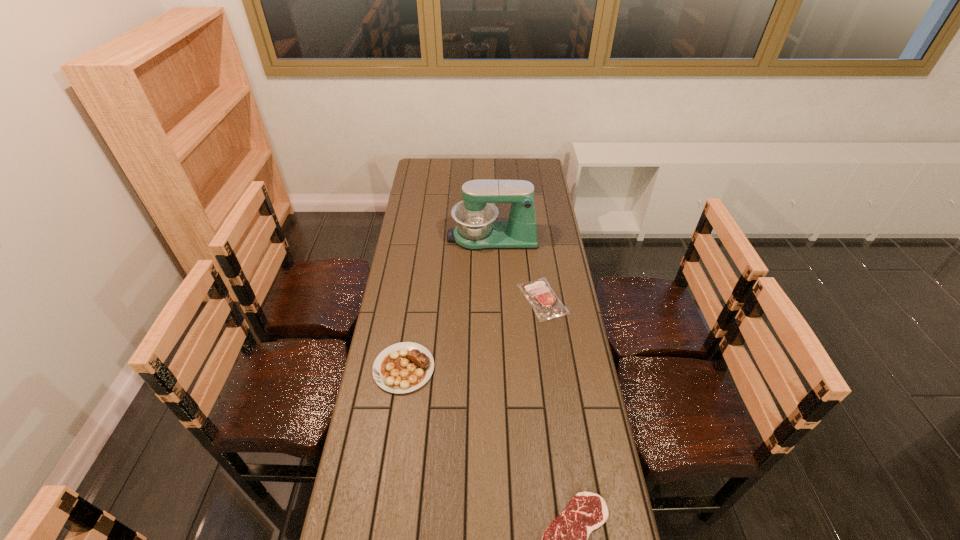
I want to click on vacant space situated 0.380m on the front of the second farthest object, so click(559, 415).

You are a GUI agent. You are given a task and a screenshot of the screen. Output one action in this format:
    pyautogui.click(x=<x>, y=<y>)
    Task: Click on the object that is at the left edge
    
    Given the screenshot: What is the action you would take?
    pyautogui.click(x=404, y=367)

Find the location of a particular element. The image size is (960, 540). mixer that is positioned at the right edge is located at coordinates (476, 229).

Identify the location of steak located at the right edge. This screenshot has width=960, height=540. (546, 305).

At what (x,y) coordinates should I click in order to perform the action: click on vacant space at the far edge. Please return your answer as a coordinate pair (x, y). The width and height of the screenshot is (960, 540). Looking at the image, I should click on (450, 174).

The image size is (960, 540). In the image, there is a desktop. Find the location of `vacant space at the left edge`. vacant space at the left edge is located at coordinates (397, 291).

Find the location of a particular element. blank area at the right edge is located at coordinates (546, 233).

You are a GUI agent. You are given a task and a screenshot of the screen. Output one action in this format:
    pyautogui.click(x=<x>, y=<y>)
    Task: Click on the blank space at the far right corner of the desktop
    
    Given the screenshot: What is the action you would take?
    pyautogui.click(x=538, y=180)

Identify the location of free space between the tallest object and the third shortest object. The image size is (960, 540). (448, 302).

Locate an element on the screen. free space that is in between the third shortest object and the farthest object is located at coordinates (448, 302).